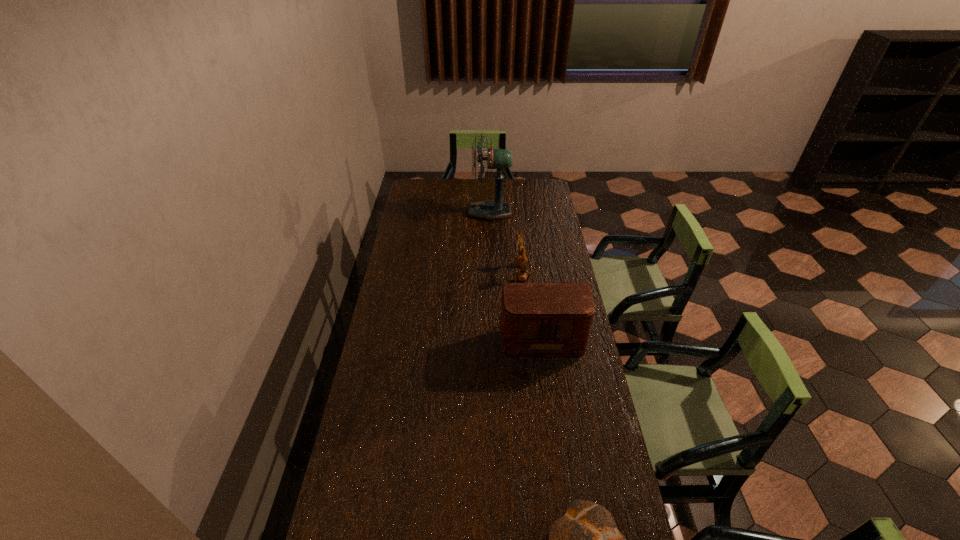
Locate an element on the screen. the farthest object is located at coordinates (490, 210).

You are a GUI agent. You are given a task and a screenshot of the screen. Output one action in this format:
    pyautogui.click(x=<x>, y=<y>)
    Task: Click on the fan
    This screenshot has height=540, width=960.
    Given the screenshot: What is the action you would take?
    pyautogui.click(x=490, y=210)

In order to click on the second tallest object in this screenshot , I will do `click(544, 321)`.

Find the location of a particular element. the second nearest object is located at coordinates (544, 321).

I want to click on the second farthest object, so click(x=521, y=260).

This screenshot has width=960, height=540. In order to click on earphone in this screenshot , I will do `click(521, 260)`.

At what (x,y) coordinates should I click in order to perform the action: click on free space located 0.190m in front of the tallest object where the wind blows. Please return your answer as a coordinate pair (x, y). Looking at the image, I should click on (432, 212).

Locate an element on the screen. The width and height of the screenshot is (960, 540). vacant space located in front of the tallest object where the wind blows is located at coordinates (456, 212).

This screenshot has height=540, width=960. Identify the location of vacant position located in front of the tallest object where the wind blows. (448, 212).

Identify the location of blank space located on the front panel of the third farthest object. This screenshot has height=540, width=960. pyautogui.click(x=554, y=430).